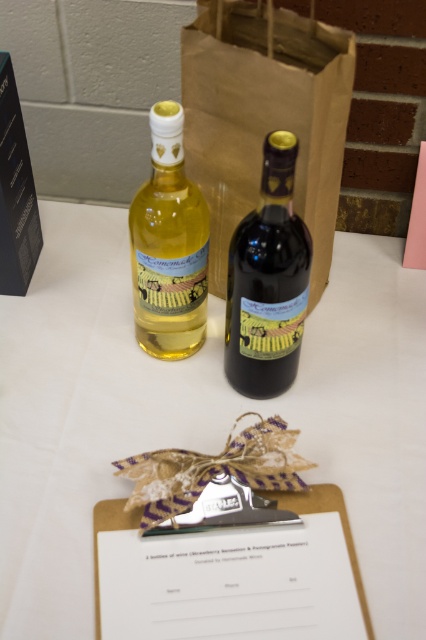
Question: Does dark glass bottle at center lie in front of matte glass bottle at upper left?

Choices:
 (A) no
 (B) yes

Answer: (B)

Question: Which object is farther from the camera taking this photo?

Choices:
 (A) brown paper bag at center
 (B) dark glass bottle at center
 (C) matte glass bottle at upper left
 (D) white cloth at center

Answer: (A)

Question: Can you confirm if white cloth at center is wider than brown paper bag at center?

Choices:
 (A) no
 (B) yes

Answer: (B)

Question: Which of these objects is positioned closest to the brown paper bag at center?

Choices:
 (A) dark glass bottle at center
 (B) white cloth at center
 (C) matte glass bottle at upper left

Answer: (C)

Question: Which point is farther from the camera taking this photo?

Choices:
 (A) click(347, 356)
 (B) click(308, 173)

Answer: (A)

Question: Observing the image, what is the correct spatial positioning of brown paper bag at center in reference to dark glass bottle at center?

Choices:
 (A) below
 (B) above

Answer: (B)